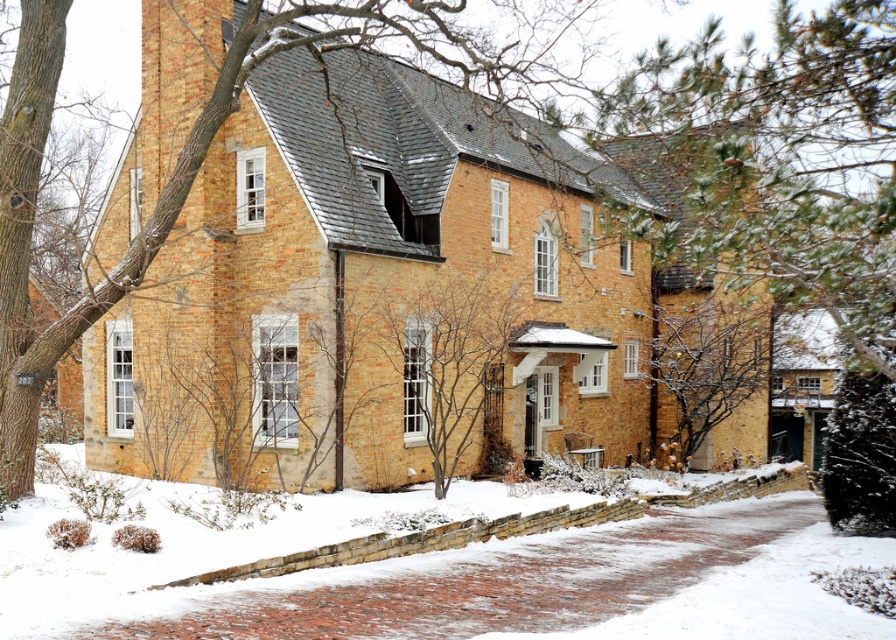
Is point (375, 611) closer to camera compared to point (448, 301)?

Yes, it is.

Does white powdery snow at lower center have a larger size compared to bare branches at center?

Yes.

This screenshot has width=896, height=640. Identify the location of white powdery snow at lower center. (446, 573).